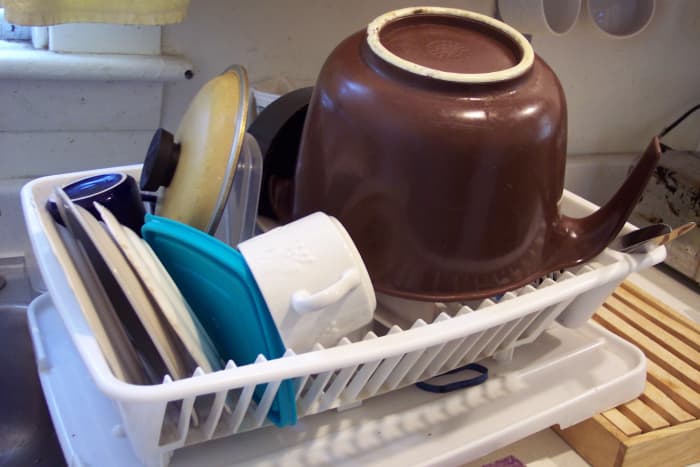
Where is `coffee cups`? This screenshot has width=700, height=467. coffee cups is located at coordinates (286, 253), (106, 201).